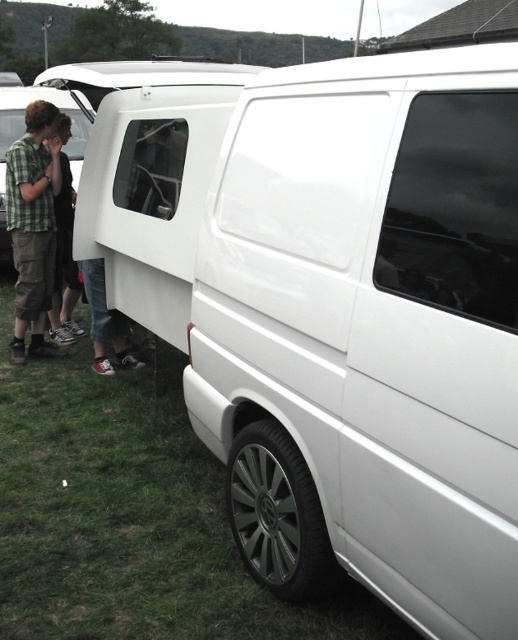
Question: Which of the following is the farthest from the observer?

Choices:
 (A) white glossy van at center
 (B) green plaid shirt at left

Answer: (B)

Question: Estimate the real-world distances between objects in this image. Which object is closer to the white glossy van at center?

Choices:
 (A) green plaid shirt at left
 (B) matte black van at left

Answer: (A)

Question: Does white glossy van at center appear over green plaid shirt at left?

Choices:
 (A) yes
 (B) no

Answer: (B)

Question: Which point is closer to the camera taking this photo?

Choices:
 (A) (38, 241)
 (B) (393, 396)

Answer: (B)

Question: Is green plaid shirt at left positioned at the back of matte black van at left?

Choices:
 (A) yes
 (B) no

Answer: (B)

Question: Is green plaid shirt at left below matte black van at left?

Choices:
 (A) no
 (B) yes

Answer: (B)